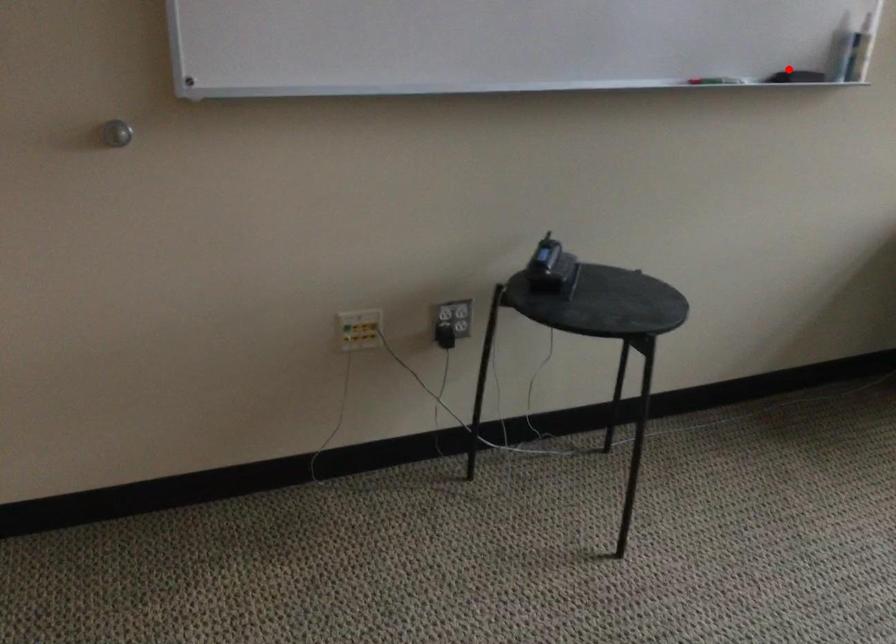
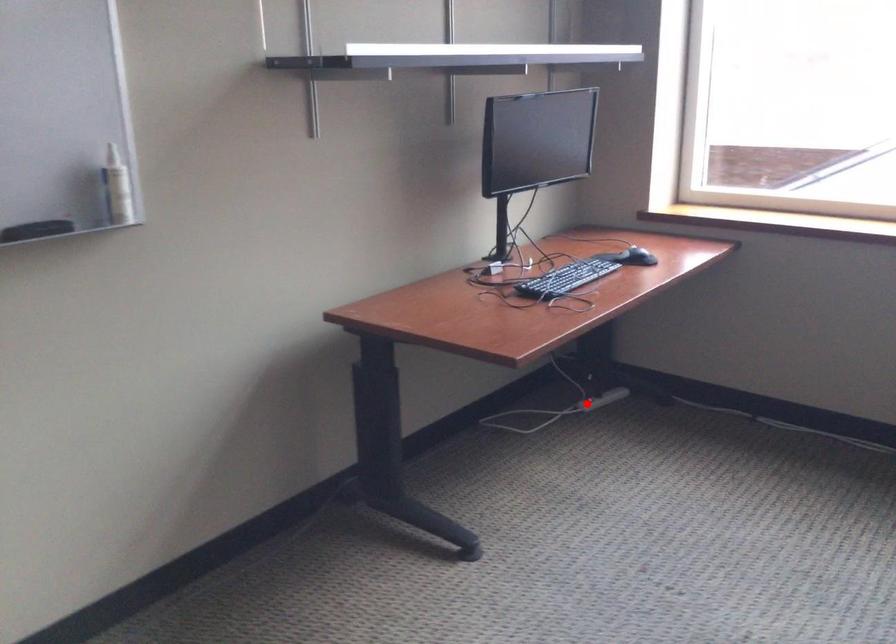
I am providing you with two images of the same scene from different viewpoints. A red point is marked on the first image and another point is marked on the second image. Do the highlighted points in image1 and image2 indicate the same real-world spot?

No